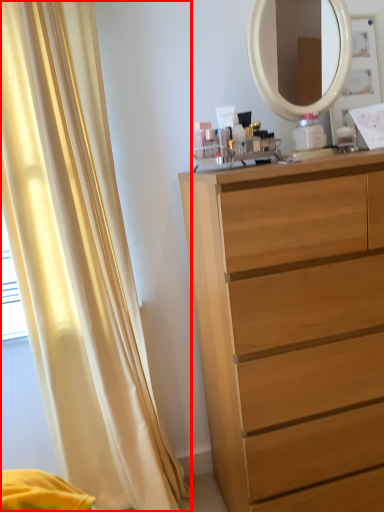
Question: From the image's perspective, considering the relative positions of curtain (annotated by the red box) and chest of drawers in the image provided, where is curtain (annotated by the red box) located with respect to the staircase?

Choices:
 (A) below
 (B) above

Answer: (B)